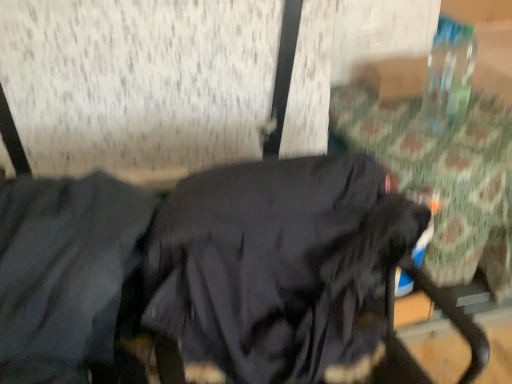
Where is `dark gray fabric jacket at left`? The width and height of the screenshot is (512, 384). dark gray fabric jacket at left is located at coordinates (65, 272).

What do you see at coordinates (65, 272) in the screenshot?
I see `dark gray fabric jacket at left` at bounding box center [65, 272].

The image size is (512, 384). I want to click on black matte sweatshirt at center, so click(275, 263).

What is the approximate width of black matte sweatshirt at center?

It is 25.83 inches.

What do you see at coordinates (275, 263) in the screenshot?
I see `black matte sweatshirt at center` at bounding box center [275, 263].

You are a GUI agent. You are given a task and a screenshot of the screen. Output one action in this format:
    pyautogui.click(x=<x>, y=<y>)
    Task: Click on the dark gray fabric jacket at left
    This screenshot has height=384, width=512.
    Given the screenshot: What is the action you would take?
    pyautogui.click(x=65, y=272)

Based on their positions, is black matte sweatshirt at center located to the left or right of dark gray fabric jacket at left?

black matte sweatshirt at center is positioned on dark gray fabric jacket at left's right side.

Considering the relative positions of black matte sweatshirt at center and dark gray fabric jacket at left in the image provided, is black matte sweatshirt at center in front of dark gray fabric jacket at left?

No, black matte sweatshirt at center is further to the viewer.

Which point is more forward, (287, 269) or (82, 382)?

The point (82, 382) is in front.

From the image's perspective, does black matte sweatshirt at center appear lower than dark gray fabric jacket at left?

Indeed, from the image's perspective, black matte sweatshirt at center is shown beneath dark gray fabric jacket at left.

From a real-world perspective, is black matte sweatshirt at center physically located above or below dark gray fabric jacket at left?

black matte sweatshirt at center is below dark gray fabric jacket at left.

In terms of width, does black matte sweatshirt at center look wider or thinner when compared to dark gray fabric jacket at left?

black matte sweatshirt at center is wider than dark gray fabric jacket at left.

Is black matte sweatshirt at center taller or shorter than dark gray fabric jacket at left?

Considering their sizes, black matte sweatshirt at center has more height than dark gray fabric jacket at left.

Considering the relative sizes of black matte sweatshirt at center and dark gray fabric jacket at left in the image provided, is black matte sweatshirt at center bigger than dark gray fabric jacket at left?

Correct, black matte sweatshirt at center is larger in size than dark gray fabric jacket at left.

Would you say black matte sweatshirt at center is inside or outside dark gray fabric jacket at left?

The correct answer is: outside.

Is black matte sweatshirt at center placed right next to dark gray fabric jacket at left?

No, black matte sweatshirt at center is not making contact with dark gray fabric jacket at left.

Is black matte sweatshirt at center facing away from dark gray fabric jacket at left?

That's not correct — black matte sweatshirt at center is not looking away from dark gray fabric jacket at left.

How different are the orientations of black matte sweatshirt at center and dark gray fabric jacket at left in degrees?

They differ by 2.77 degrees in their facing directions.

In order to click on sweatshirt on the right of dark gray fabric jacket at left in this screenshot , I will do pyautogui.click(x=275, y=263).

Which object is positioned more to the right, dark gray fabric jacket at left or black matte sweatshirt at center?

black matte sweatshirt at center.

Which object is further away from the camera, dark gray fabric jacket at left or black matte sweatshirt at center?

black matte sweatshirt at center.

Which is more distant, (130, 259) or (245, 219)?

The point (245, 219) is farther.

From the image's perspective, relative to black matte sweatshirt at center, is dark gray fabric jacket at left above or below?

Based on their image positions, dark gray fabric jacket at left is located above black matte sweatshirt at center.

From a real-world perspective, relative to black matte sweatshirt at center, is dark gray fabric jacket at left vertically above or below?

In terms of real-world spatial position, dark gray fabric jacket at left is above black matte sweatshirt at center.

Is dark gray fabric jacket at left wider or thinner than black matte sweatshirt at center?

In the image, dark gray fabric jacket at left appears to be more narrow than black matte sweatshirt at center.

Can you confirm if dark gray fabric jacket at left is taller than black matte sweatshirt at center?

No.

Is dark gray fabric jacket at left bigger or smaller than black matte sweatshirt at center?

dark gray fabric jacket at left is smaller than black matte sweatshirt at center.

Is dark gray fabric jacket at left not inside black matte sweatshirt at center?

dark gray fabric jacket at left is positioned outside black matte sweatshirt at center.

Are dark gray fabric jacket at left and black matte sweatshirt at center far apart?

They are positioned close to each other.

Is dark gray fabric jacket at left turned away from black matte sweatshirt at center?

No, dark gray fabric jacket at left is not facing the opposite direction of black matte sweatshirt at center.

In the image, there is a black matte sweatshirt at center. Where is `jacket above it (from the image's perspective)`? The image size is (512, 384). jacket above it (from the image's perspective) is located at coordinates (65, 272).

Find the location of `jacket above the black matte sweatshirt at center (from the image's perspective)`. jacket above the black matte sweatshirt at center (from the image's perspective) is located at coordinates (65, 272).

Find the location of `sweatshirt located behind the dark gray fabric jacket at left`. sweatshirt located behind the dark gray fabric jacket at left is located at coordinates (275, 263).